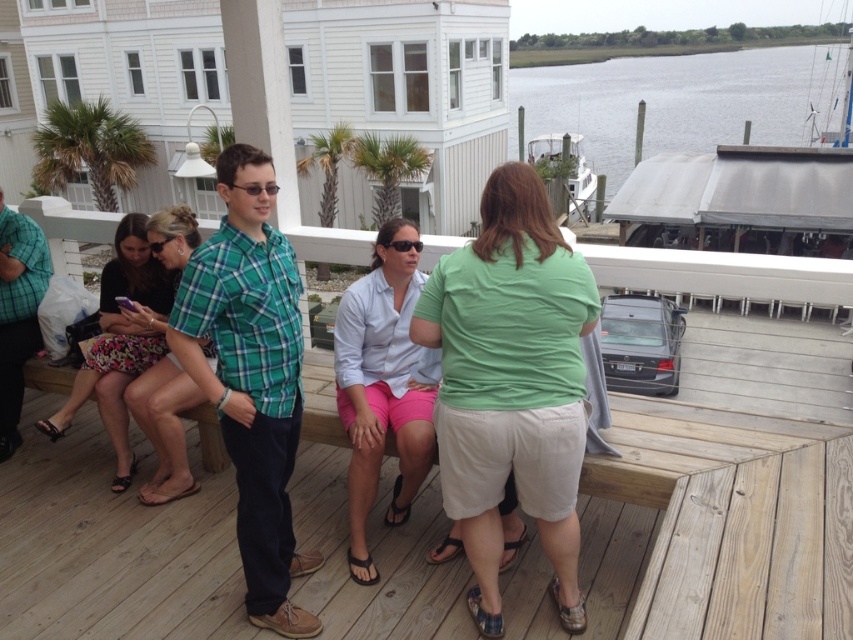
Question: Is green plaid shirt at center positioned behind green plaid shirt at left?

Choices:
 (A) yes
 (B) no

Answer: (B)

Question: Which point is farther from the camera taking this photo?

Choices:
 (A) (119, 456)
 (B) (151, 488)
 (C) (364, 547)

Answer: (A)

Question: Which is nearer to the floral skirt at lower left?

Choices:
 (A) floral cotton skirt at left
 (B) green plaid shirt at left

Answer: (A)

Question: Which of the following is the farthest from the observer?

Choices:
 (A) green plaid shirt at left
 (B) floral skirt at lower left

Answer: (A)

Question: Can you confirm if gray water at upper right is smaller than floral cotton skirt at left?

Choices:
 (A) no
 (B) yes

Answer: (A)

Question: Is green plaid shirt at center smaller than gray water at upper right?

Choices:
 (A) no
 (B) yes

Answer: (B)